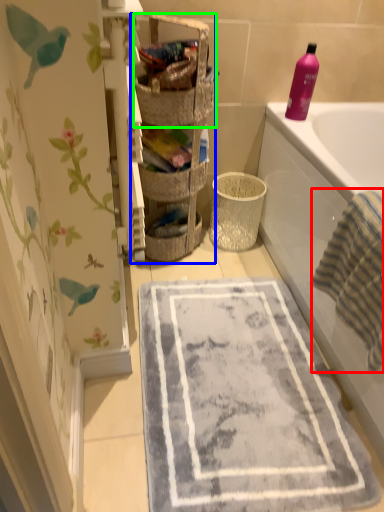
Question: Which is farther away from beach towel (highlighted by a red box)? shelf (highlighted by a blue box) or basket (highlighted by a green box)?

Choices:
 (A) shelf
 (B) basket

Answer: (B)